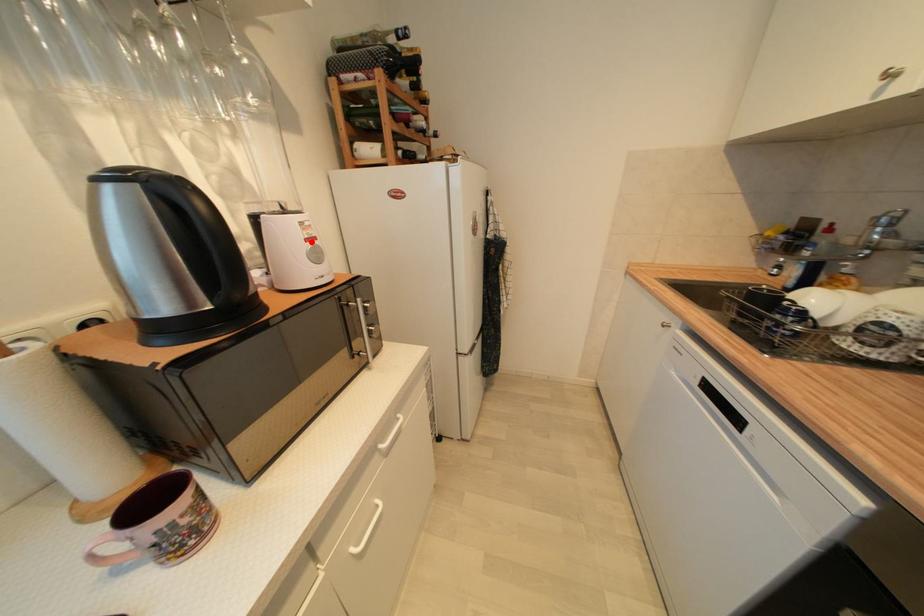
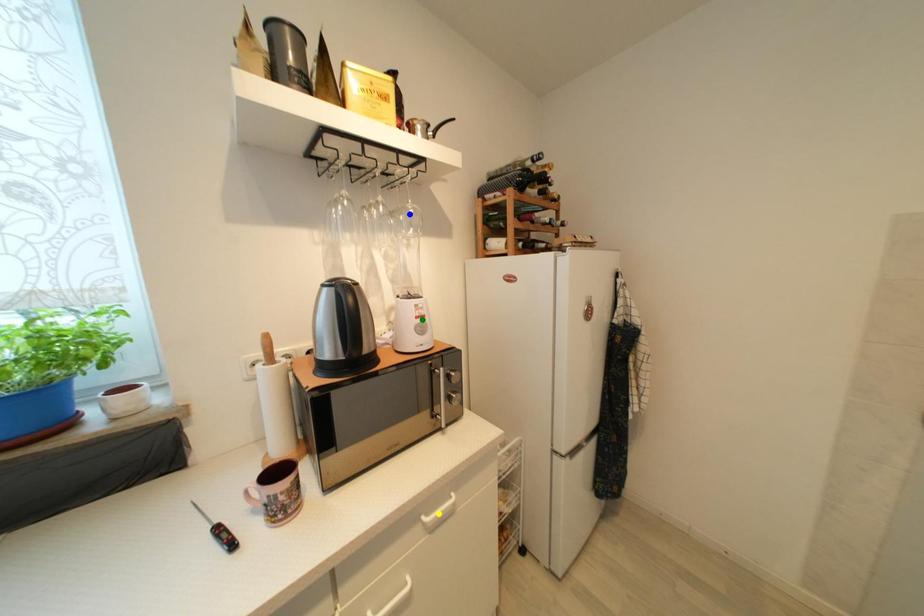
Question: I am providing you with two images of the same scene from different viewpoints. A red point is marked on the first image. You are given multiple points on the second image. Which point in image 2 is actually the same real-world point as the red point in image 1?

Choices:
 (A) green point
 (B) blue point
 (C) yellow point

Answer: (A)